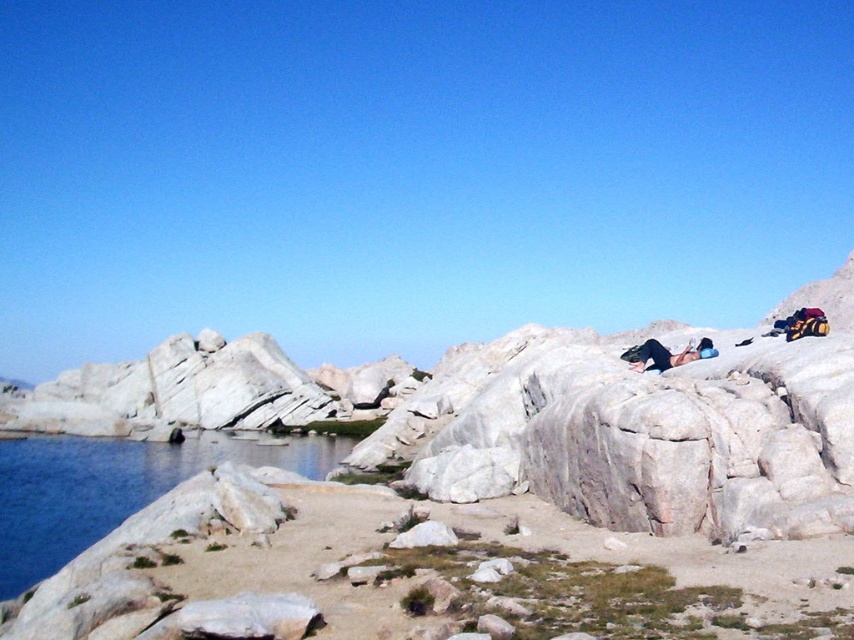
Between blue smooth water at lower left and black fabric person at center, which one appears on the left side from the viewer's perspective?

blue smooth water at lower left is more to the left.

Does blue smooth water at lower left have a greater width compared to black fabric person at center?

Yes.

Locate an element on the screen. Image resolution: width=854 pixels, height=640 pixels. blue smooth water at lower left is located at coordinates (114, 486).